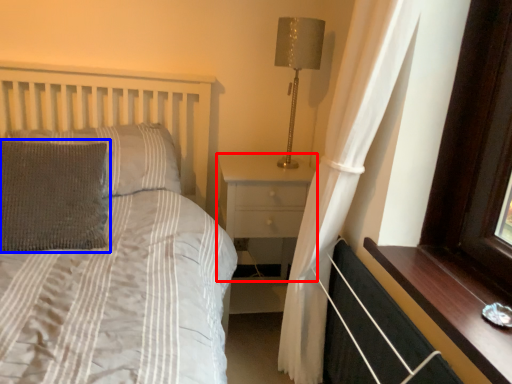
Question: Among these objects, which one is nearest to the camera, nightstand (highlighted by a red box) or pillow (highlighted by a blue box)?

Choices:
 (A) nightstand
 (B) pillow

Answer: (B)